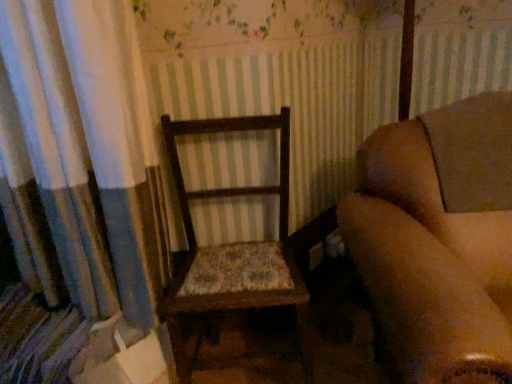
Locate an element on the screen. This screenshot has width=512, height=384. wooden chair at center is located at coordinates (439, 239).

This screenshot has height=384, width=512. What do you see at coordinates (439, 239) in the screenshot?
I see `wooden chair at center` at bounding box center [439, 239].

In the scene shown: What is the approximate height of wooden chair at center?

It is 84.93 centimeters.

I want to click on wooden chair with floral cushion at center, so click(x=234, y=247).

In order to face wooden chair with floral cushion at center, should I rotate leftwards or rightwards?

Turn left approximately 2.562 degrees to face it.

Describe the element at coordinates (234, 247) in the screenshot. I see `wooden chair with floral cushion at center` at that location.

The height and width of the screenshot is (384, 512). Identify the location of wooden chair at center. pyautogui.click(x=439, y=239).

Considering the positions of objects wooden chair at center and wooden chair with floral cushion at center in the image provided, who is more to the left, wooden chair at center or wooden chair with floral cushion at center?

wooden chair with floral cushion at center.

Is wooden chair at center in front of or behind wooden chair with floral cushion at center in the image?

wooden chair at center is positioned closer to the viewer than wooden chair with floral cushion at center.

Does point (460, 193) appear closer or farther from the camera than point (232, 131)?

Clearly, point (460, 193) is closer to the camera than point (232, 131).

In the scene shown: From the image's perspective, relative to wooden chair with floral cushion at center, is wooden chair at center above or below?

Clearly, from the image's perspective, wooden chair at center is below wooden chair with floral cushion at center.

From a real-world perspective, is wooden chair at center on top of wooden chair with floral cushion at center?

Yes.

Is wooden chair at center thinner than wooden chair with floral cushion at center?

No, wooden chair at center is not thinner than wooden chair with floral cushion at center.

Is wooden chair at center shorter than wooden chair with floral cushion at center?

In fact, wooden chair at center may be taller than wooden chair with floral cushion at center.

Which of these two, wooden chair at center or wooden chair with floral cushion at center, is smaller?

Smaller between the two is wooden chair with floral cushion at center.

Which is correct: wooden chair at center is inside wooden chair with floral cushion at center, or outside of it?

wooden chair at center exists outside the volume of wooden chair with floral cushion at center.

Is wooden chair at center beside wooden chair with floral cushion at center?

wooden chair at center and wooden chair with floral cushion at center are clearly separated.

Could you tell me if wooden chair at center is facing wooden chair with floral cushion at center?

No, wooden chair at center is not facing towards wooden chair with floral cushion at center.

How far apart are wooden chair at center and wooden chair with floral cushion at center?

wooden chair at center and wooden chair with floral cushion at center are 16.36 inches apart from each other.

This screenshot has height=384, width=512. I want to click on rocking chair lying on the left of wooden chair at center, so click(234, 247).

Does wooden chair with floral cushion at center appear on the right side of wooden chair at center?

No.

Looking at this image, which object is closer to the camera, wooden chair with floral cushion at center or wooden chair at center?

Positioned in front is wooden chair at center.

Is point (241, 278) closer or farther from the camera than point (479, 189)?

Point (241, 278) is positioned farther from the camera compared to point (479, 189).

From the picture: From the image's perspective, who appears lower, wooden chair with floral cushion at center or wooden chair at center?

wooden chair at center is shown below in the image.

From a real-world perspective, is wooden chair with floral cushion at center above or below wooden chair at center?

From a real-world perspective, wooden chair with floral cushion at center is physically below wooden chair at center.

Considering the relative sizes of wooden chair with floral cushion at center and wooden chair at center in the image provided, is wooden chair with floral cushion at center wider than wooden chair at center?

Incorrect, the width of wooden chair with floral cushion at center does not surpass that of wooden chair at center.

Considering the relative sizes of wooden chair with floral cushion at center and wooden chair at center in the image provided, is wooden chair with floral cushion at center shorter than wooden chair at center?

Correct, wooden chair with floral cushion at center is not as tall as wooden chair at center.

Based on their sizes in the image, would you say wooden chair with floral cushion at center is bigger or smaller than wooden chair at center?

Considering their sizes, wooden chair with floral cushion at center takes up less space than wooden chair at center.

From the picture: Would you say wooden chair with floral cushion at center contains wooden chair at center?

Definitely not — wooden chair at center is not inside wooden chair with floral cushion at center.

Are wooden chair with floral cushion at center and wooden chair at center making contact?

No, wooden chair with floral cushion at center is not making contact with wooden chair at center.

Is wooden chair with floral cushion at center turned away from wooden chair at center?

No, wooden chair with floral cushion at center is not facing away from wooden chair at center.

Can you tell me how much wooden chair with floral cushion at center and wooden chair at center differ in facing direction?

The facing directions of wooden chair with floral cushion at center and wooden chair at center are 5.04 degrees apart.

Locate an element on the screen. The width and height of the screenshot is (512, 384). chair above the wooden chair with floral cushion at center (from a real-world perspective) is located at coordinates (439, 239).

Where is `rocking chair above the wooden chair at center (from the image's perspective)`? rocking chair above the wooden chair at center (from the image's perspective) is located at coordinates (234, 247).

Image resolution: width=512 pixels, height=384 pixels. Identify the location of chair above the wooden chair with floral cushion at center (from a real-world perspective). (439, 239).